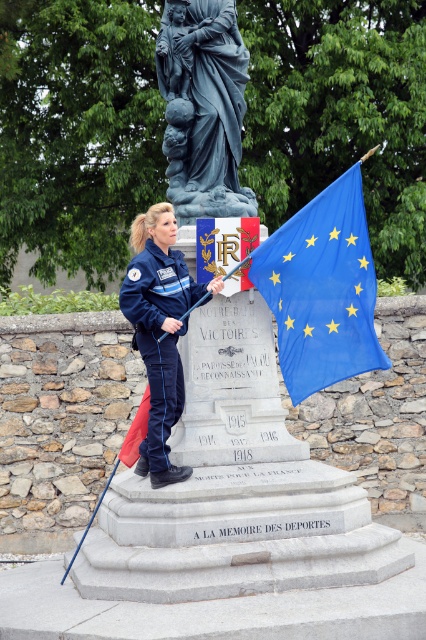
What is located at the coordinates point (203, 106)?

The blue stone statue at upper center is located at point (203, 106).

You are a tourist standing in front of the monument. You see a point marked at coordinates [322,289]. What object is located at this point?

The point at coordinates [322,289] corresponds to the blue fabric flag at right.

You are a photographer positioned to take a photo of the monument and the police officer. You notice two points marked on your viewfinder at coordinates point (213, 104) and point (170, 260). Which point is closer to the camera?

Point (170, 260) is closer to the camera because it is less further than point (213, 104) according to the description.